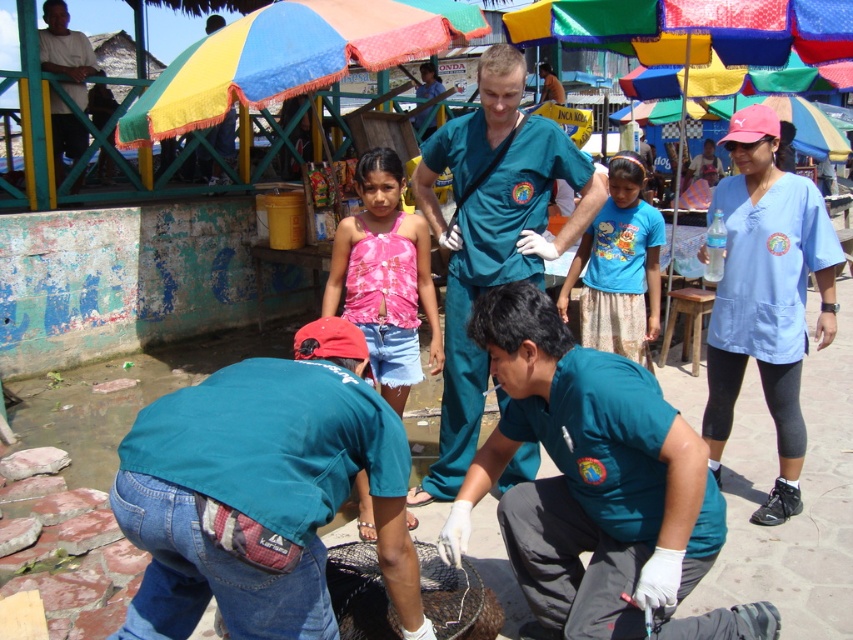
You are a photographer at the market scene. You need to capture a photo that includes both the pink fabric top at center and the white cotton shirt at upper left. Based on their positions, which one should be positioned on the right side of the photo to ensure both are visible?

The pink fabric top at center should be positioned on the right side of the photo because it is already to the right of the white cotton shirt at upper left in the scene.

You are a person standing in the market area and want to reach the pink fabric top at center without getting hit by the multicolored fabric umbrella at upper center. How should you position yourself?

The multicolored fabric umbrella at upper center is located above the pink fabric top at center, so to avoid getting hit by the umbrella, you should position yourself directly below the pink fabric top at center where the umbrella does not extend.